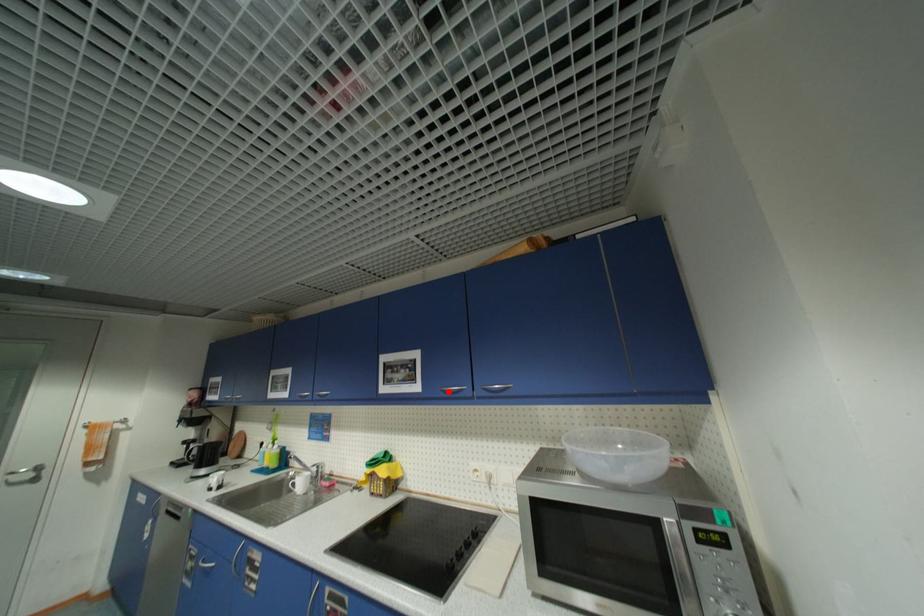
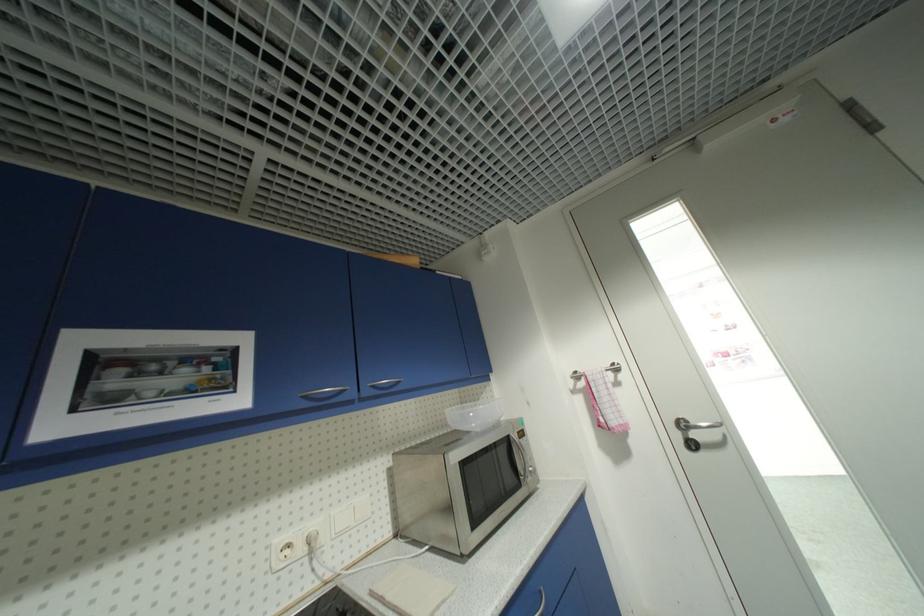
Question: I am providing you with two images of the same scene from different viewpoints. A red point is marked on the first image. Is the red point's position out of view in image 2?

Choices:
 (A) Yes
 (B) No

Answer: (B)